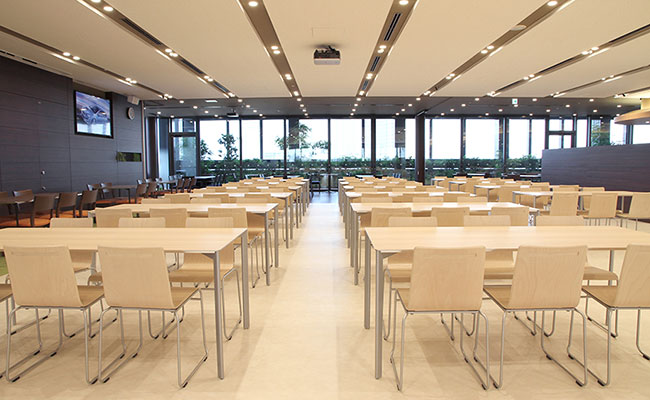
What are the coordinates of `ceiling sections` in the screenshot? It's located at (60, 69), (108, 51), (213, 35), (337, 19), (444, 21), (556, 38), (595, 67), (617, 86).